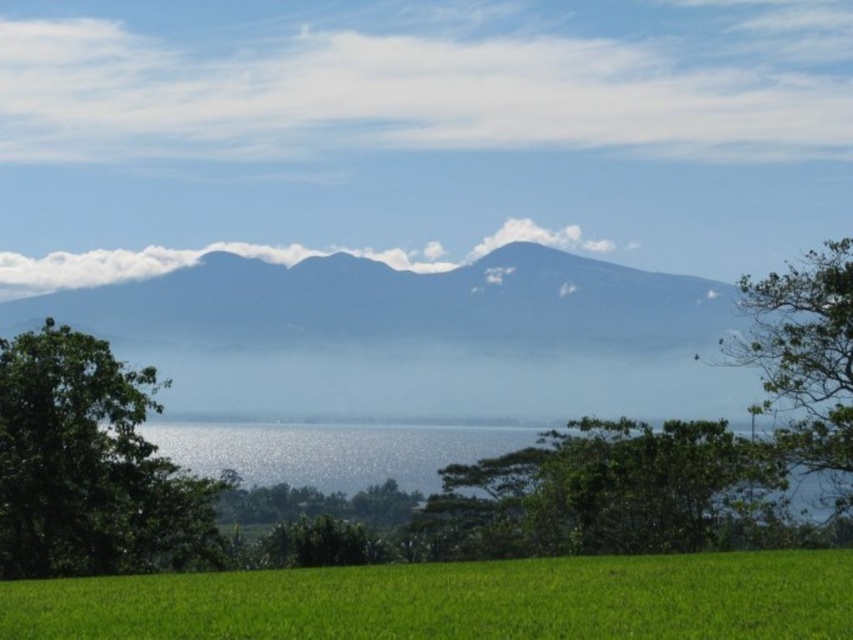
Question: Is green grassy field at lower center in front of green leafy tree at center?

Choices:
 (A) yes
 (B) no

Answer: (A)

Question: Does green leafy tree at left appear under green leafy tree at center?

Choices:
 (A) yes
 (B) no

Answer: (A)

Question: Among these points, which one is nearest to the camera?

Choices:
 (A) (788, 307)
 (B) (664, 540)

Answer: (B)

Question: Which point is farther from the camera taking this photo?

Choices:
 (A) (56, 522)
 (B) (595, 611)
 (C) (787, 369)

Answer: (C)

Question: Which object appears farthest from the camera in this image?

Choices:
 (A) green leafy tree at right
 (B) green grassy field at lower center

Answer: (A)

Question: Does green leafy tree at left have a smaller size compared to green leafy tree at right?

Choices:
 (A) yes
 (B) no

Answer: (B)